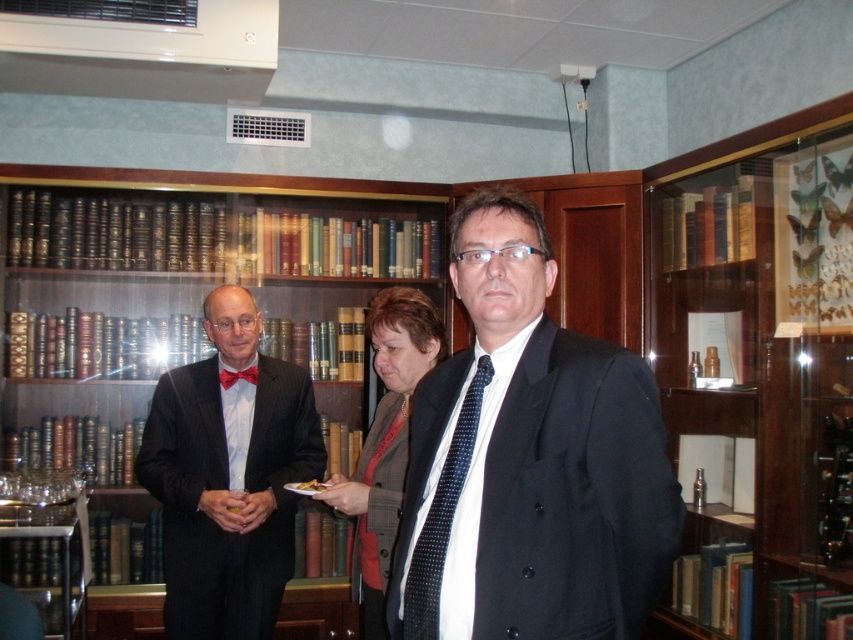
You are a photographer positioned in front of the matte black suit at center and the matte red bow tie at center. You want to take a photo that captures both objects in the frame. Given that your camera has a maximum focus range of 4 feet, will you be able to capture both objects clearly without moving the camera?

The matte black suit at center and the matte red bow tie at center are 4.56 feet apart, which exceeds the camera maximum focus range of 4 feet. Therefore, you won t be able to capture both objects clearly without moving the camera.